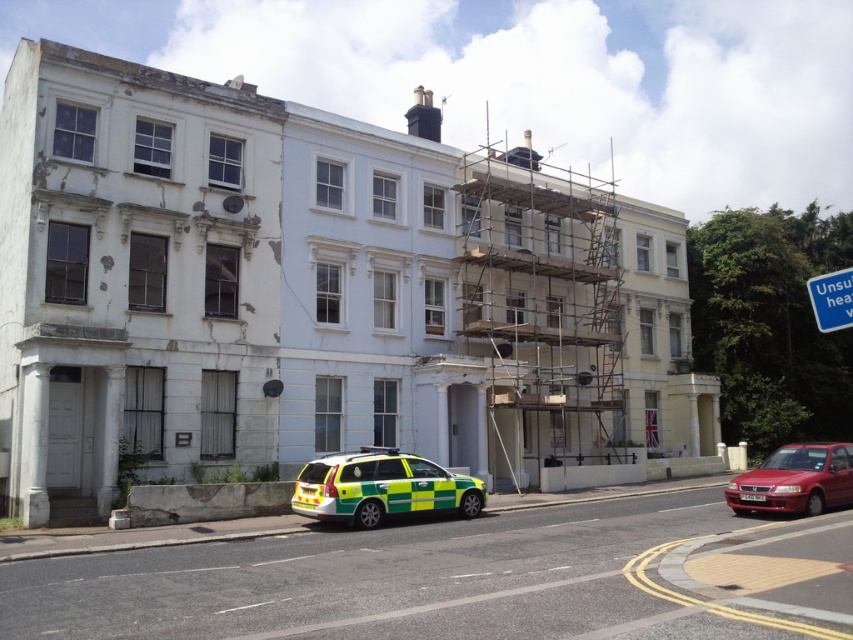
Which is behind, point (341, 493) or point (838, 280)?

The point (341, 493) is more distant.

Is green/yellow striped ambulance at lower center in front of blue plastic sign at upper right?

No, it is not.

Which is in front, point (401, 467) or point (822, 285)?

Point (822, 285) is in front.

Image resolution: width=853 pixels, height=640 pixels. I want to click on green/yellow striped ambulance at lower center, so click(381, 486).

Consider the image. Who is shorter, green/yellow striped ambulance at lower center or metallic red sedan at lower right?

Standing shorter between the two is green/yellow striped ambulance at lower center.

Which is in front, point (344, 492) or point (767, 484)?

Point (767, 484)

Where is `green/yellow striped ambulance at lower center`? The height and width of the screenshot is (640, 853). green/yellow striped ambulance at lower center is located at coordinates (381, 486).

Can you confirm if metallic red sedan at lower right is positioned to the right of blue plastic sign at upper right?

No, metallic red sedan at lower right is not to the right of blue plastic sign at upper right.

In order to click on metallic red sedan at lower right in this screenshot , I will do `click(795, 481)`.